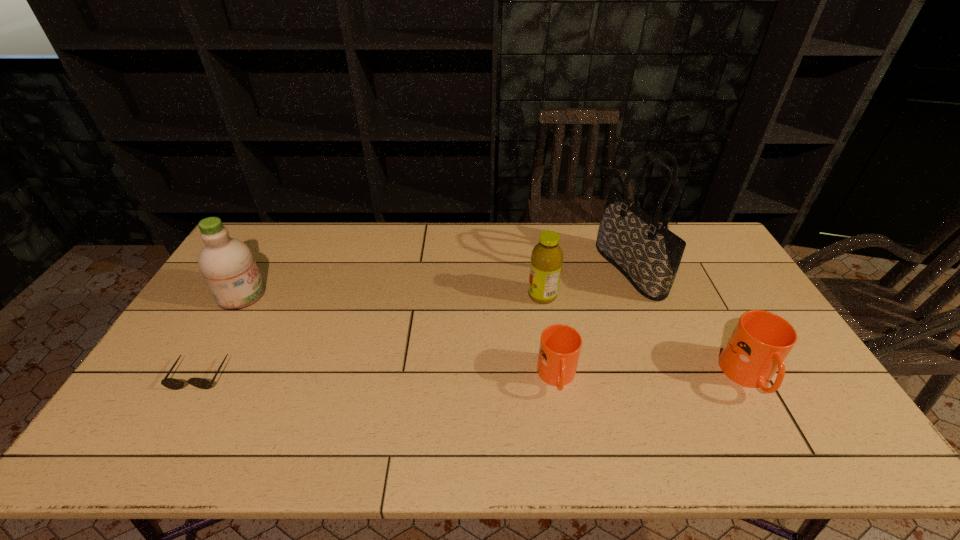
Where is `the fifth tallest object`? The width and height of the screenshot is (960, 540). the fifth tallest object is located at coordinates (560, 345).

I want to click on the shorter mug, so click(x=560, y=345).

At what (x,y) coordinates should I click in order to perform the action: click on the rightmost object. Please return your answer as a coordinate pair (x, y). Looking at the image, I should click on (760, 342).

Locate an element on the screen. The image size is (960, 540). the taller mug is located at coordinates (760, 342).

You are a GUI agent. You are given a task and a screenshot of the screen. Output one action in this format:
    pyautogui.click(x=<x>, y=<y>)
    Task: Click on the second tallest object
    
    Given the screenshot: What is the action you would take?
    pyautogui.click(x=227, y=264)

Where is `the tallest object`? the tallest object is located at coordinates (647, 253).

This screenshot has width=960, height=540. I want to click on tote bag, so click(x=647, y=253).

Locate an element on the screen. The height and width of the screenshot is (540, 960). the fourth shortest object is located at coordinates (547, 257).

The width and height of the screenshot is (960, 540). I want to click on the shortest object, so click(171, 383).

This screenshot has height=540, width=960. Find the location of `vacant area situated 0.070m on the front label of the cleansing agent`. vacant area situated 0.070m on the front label of the cleansing agent is located at coordinates (286, 294).